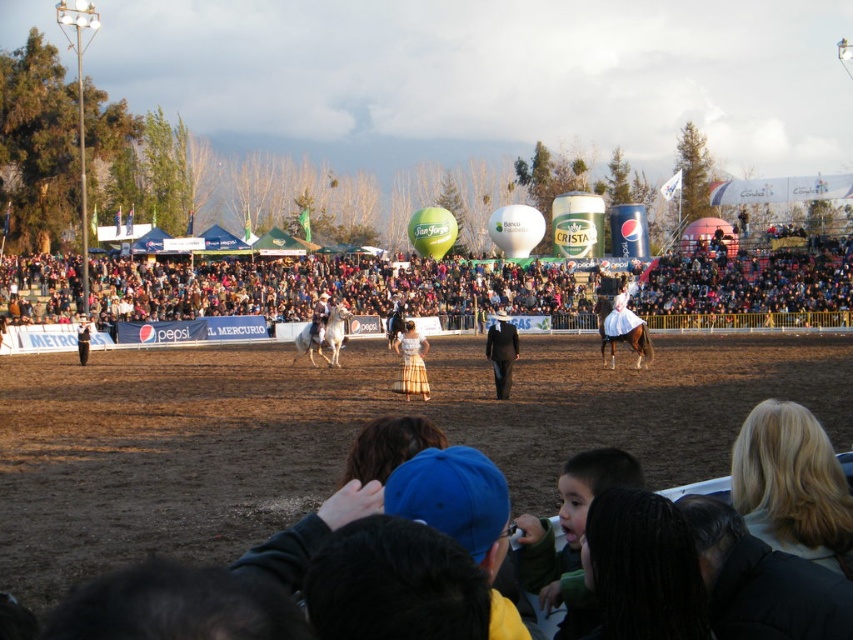
Question: Is blonde hair at upper right positioned in front of black fabric at lower right?

Choices:
 (A) yes
 (B) no

Answer: (B)

Question: Which object is the closest to the green matte balloon at center?

Choices:
 (A) brown glossy horse at center
 (B) blonde hair at upper right

Answer: (A)

Question: Which point is closer to the camera?

Choices:
 (A) (537, 269)
 (B) (817, 486)
 (C) (407, 228)
 (D) (486, 358)

Answer: (B)

Question: Is dark brown leather jacket at center to the left of green matte balloon at center from the viewer's perspective?

Choices:
 (A) yes
 (B) no

Answer: (B)

Question: Is brown glossy horse at center positioned at the back of plaid skirt at center?

Choices:
 (A) no
 (B) yes

Answer: (B)

Question: Which object appears closest to the camera in this image?

Choices:
 (A) brown glossy horse at center
 (B) black fabric at lower right
 (C) white glossy horse at center

Answer: (B)